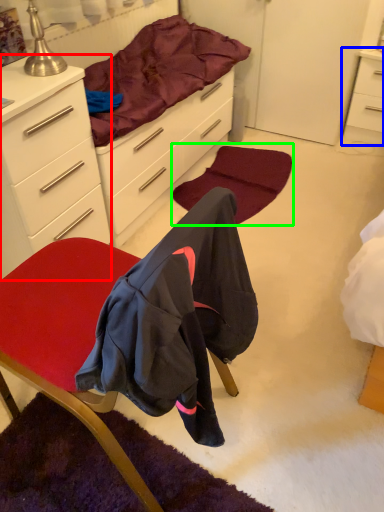
Question: Considering the real-world distances, which object is closest to cabinetry (highlighted by a red box)? nightstand (highlighted by a blue box) or mat (highlighted by a green box).

Choices:
 (A) nightstand
 (B) mat

Answer: (B)